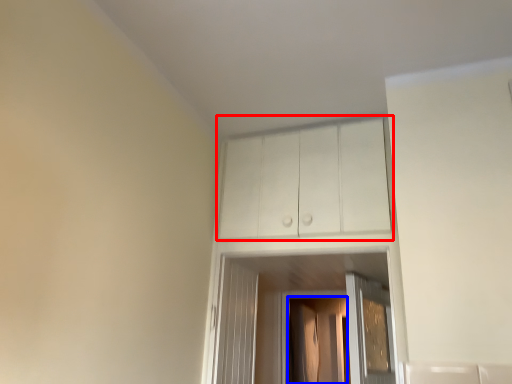
Question: Among these objects, which one is nearest to the camera, cabinetry (highlighted by a red box) or screen door (highlighted by a blue box)?

Choices:
 (A) cabinetry
 (B) screen door

Answer: (A)